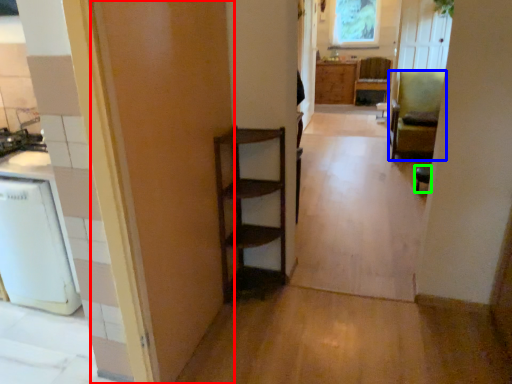
Question: Which object is the farthest from door (highlighted by a red box)? Choose among these: chair (highlighted by a blue box) or chair (highlighted by a green box).

Choices:
 (A) chair
 (B) chair

Answer: (A)